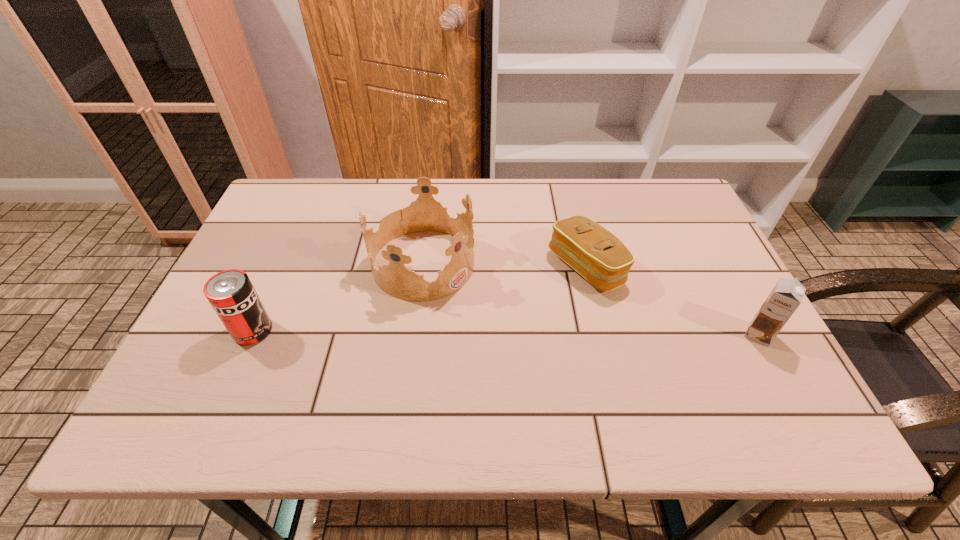
Locate an element on the screen. This screenshot has height=540, width=960. vacant space on the desktop that is between the can and the rightmost object and is positioned on the front-facing side of the third object from right to left is located at coordinates (529, 333).

Where is `free space on the desktop that is between the can and the chocolate milk and is positioned on the zipper side of the second object from right to left`? The width and height of the screenshot is (960, 540). free space on the desktop that is between the can and the chocolate milk and is positioned on the zipper side of the second object from right to left is located at coordinates (443, 332).